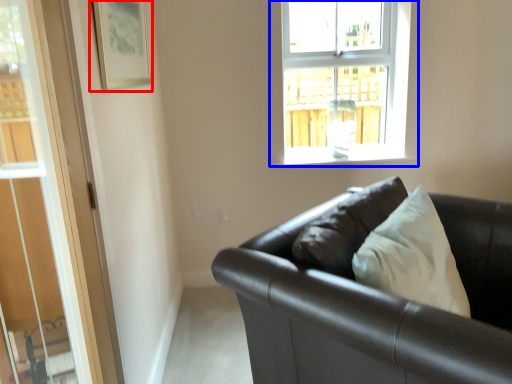
Question: Which point is closer to the camera, picture frame (highlighted by a red box) or window (highlighted by a blue box)?

Choices:
 (A) picture frame
 (B) window

Answer: (A)